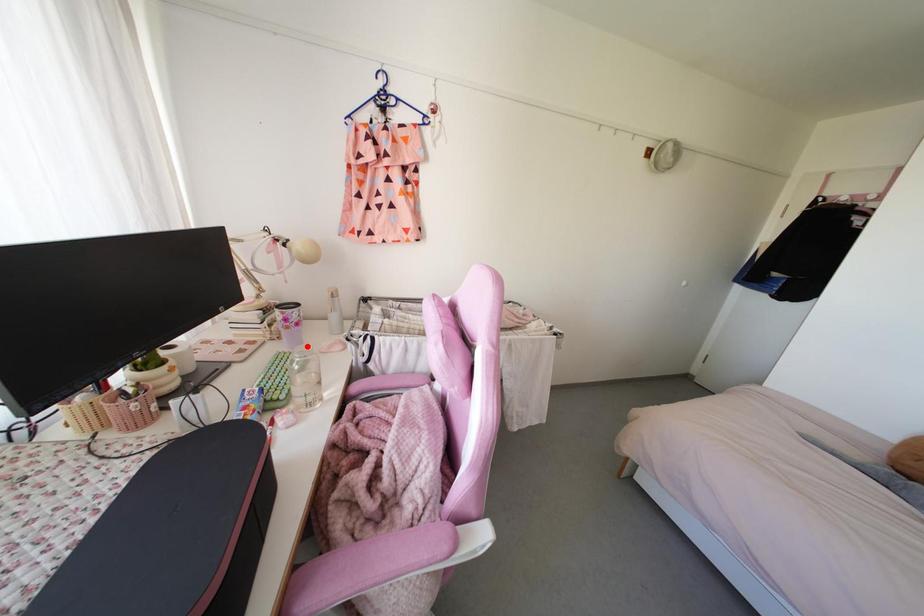
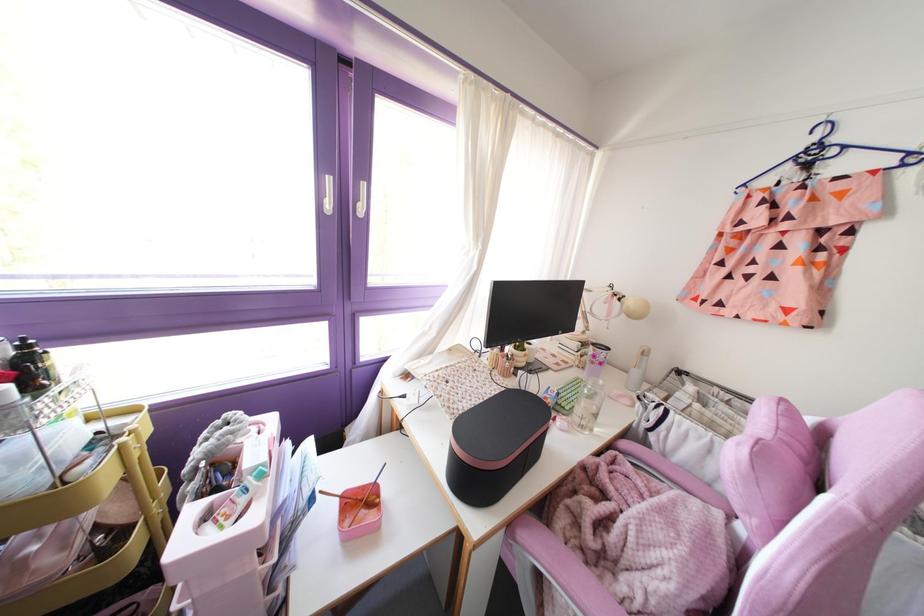
In the second image, find the point that corresponds to the highlighted location in the first image.

(601, 382)